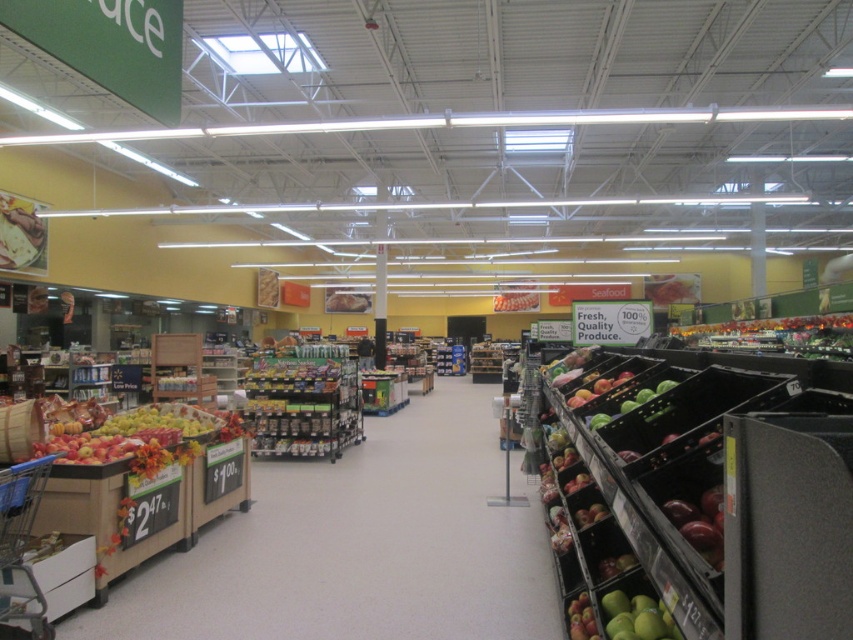
Question: Is wooden crate apples at left to the left of shiny red apple at lower right from the viewer's perspective?

Choices:
 (A) no
 (B) yes

Answer: (B)

Question: Estimate the real-world distances between objects in this image. Which object is farther from the shiny red apple at lower right?

Choices:
 (A) wooden crate apples at left
 (B) green matte apples at center
 (C) green matte apples at lower right

Answer: (A)

Question: Does wooden crate apples at left have a smaller size compared to green matte apples at center?

Choices:
 (A) no
 (B) yes

Answer: (A)

Question: Estimate the real-world distances between objects in this image. Which object is closer to the wooden crate apples at left?

Choices:
 (A) shiny red apple at lower right
 (B) green matte apples at lower right
 (C) green matte apples at center

Answer: (B)

Question: Does wooden crate apples at left appear over shiny red apple at lower right?

Choices:
 (A) no
 (B) yes

Answer: (A)

Question: Which point appears closest to the camera in this image?

Choices:
 (A) (704, 493)
 (B) (241, 534)

Answer: (A)